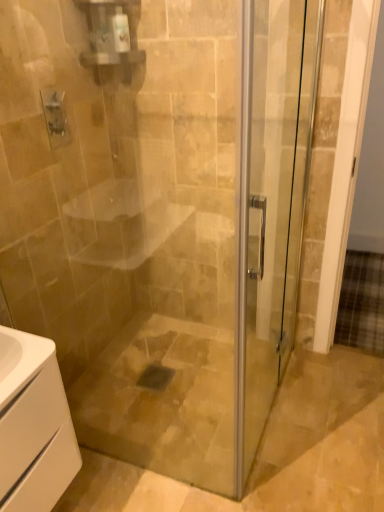
At what (x,y) coordinates should I click in order to perform the action: click on transparent glass shower door at right. Please return your answer as a coordinate pair (x, y). Looking at the image, I should click on (272, 200).

In order to face transparent glass shower door at right, should I rotate leftwards or rightwards?

Turn right by 11.849 degrees to look at transparent glass shower door at right.

The width and height of the screenshot is (384, 512). What do you see at coordinates (272, 200) in the screenshot?
I see `transparent glass shower door at right` at bounding box center [272, 200].

Measure the distance between transparent glass shower door at right and camera.

3.39 feet.

Measure the distance between point (63,490) and camera.

Point (63,490) and camera are 1.31 meters apart.

What is the approximate height of white matte cabinet at lower left?

white matte cabinet at lower left is 19.71 inches in height.

What do you see at coordinates (33, 425) in the screenshot?
I see `white matte cabinet at lower left` at bounding box center [33, 425].

This screenshot has width=384, height=512. In order to click on white matte cabinet at lower left in this screenshot , I will do `click(33, 425)`.

At what (x,y) coordinates should I click in order to perform the action: click on transparent glass shower door at right. Please return your answer as a coordinate pair (x, y). The width and height of the screenshot is (384, 512). Looking at the image, I should click on (272, 200).

Is white matte cabinet at lower left to the left of transparent glass shower door at right from the viewer's perspective?

Correct, you'll find white matte cabinet at lower left to the left of transparent glass shower door at right.

Consider the image. Between white matte cabinet at lower left and transparent glass shower door at right, which one is positioned in front?

transparent glass shower door at right is in front.

Does point (14, 395) come behind point (277, 164)?

No, (14, 395) is closer to viewer.

From the image's perspective, which is above, white matte cabinet at lower left or transparent glass shower door at right?

transparent glass shower door at right appears higher in the image.

From a real-world perspective, which is physically below, white matte cabinet at lower left or transparent glass shower door at right?

white matte cabinet at lower left.

Looking at their sizes, would you say white matte cabinet at lower left is wider or thinner than transparent glass shower door at right?

Considering their sizes, white matte cabinet at lower left looks broader than transparent glass shower door at right.

Considering the sizes of objects white matte cabinet at lower left and transparent glass shower door at right in the image provided, who is shorter, white matte cabinet at lower left or transparent glass shower door at right?

white matte cabinet at lower left is shorter.

Considering the sizes of objects white matte cabinet at lower left and transparent glass shower door at right in the image provided, who is smaller, white matte cabinet at lower left or transparent glass shower door at right?

white matte cabinet at lower left.

Is white matte cabinet at lower left completely or partially outside of transparent glass shower door at right?

Absolutely, white matte cabinet at lower left is external to transparent glass shower door at right.

Is white matte cabinet at lower left with transparent glass shower door at right?

They are not placed beside each other.

Could you tell me if white matte cabinet at lower left is facing transparent glass shower door at right?

No, white matte cabinet at lower left is not aimed at transparent glass shower door at right.

Consider the image. How many degrees apart are the facing directions of white matte cabinet at lower left and transparent glass shower door at right?

The angle between the facing direction of white matte cabinet at lower left and the facing direction of transparent glass shower door at right is 0.544 degrees.

You are a GUI agent. You are given a task and a screenshot of the screen. Output one action in this format:
    pyautogui.click(x=<x>, y=<y>)
    Task: Click on the bathroom cabinet behind the transparent glass shower door at right
    This screenshot has width=384, height=512.
    Given the screenshot: What is the action you would take?
    pyautogui.click(x=33, y=425)

Does transparent glass shower door at right appear on the right side of white matte cabinet at lower left?

Correct, you'll find transparent glass shower door at right to the right of white matte cabinet at lower left.

Is transparent glass shower door at right positioned in front of white matte cabinet at lower left?

Yes, transparent glass shower door at right is closer to the viewer.

Which is farther from the camera, (313, 55) or (61, 399)?

The point (313, 55) is farther from the camera.

From the image's perspective, is transparent glass shower door at right above or below white matte cabinet at lower left?

Clearly, from the image's perspective, transparent glass shower door at right is above white matte cabinet at lower left.

From a real-world perspective, between transparent glass shower door at right and white matte cabinet at lower left, who is vertically lower?

white matte cabinet at lower left, from a real-world perspective.

Considering the sizes of transparent glass shower door at right and white matte cabinet at lower left in the image, is transparent glass shower door at right wider or thinner than white matte cabinet at lower left?

Clearly, transparent glass shower door at right has less width compared to white matte cabinet at lower left.

Does transparent glass shower door at right have a greater height compared to white matte cabinet at lower left?

Correct, transparent glass shower door at right is much taller as white matte cabinet at lower left.

Does transparent glass shower door at right have a smaller size compared to white matte cabinet at lower left?

Actually, transparent glass shower door at right might be larger than white matte cabinet at lower left.

Is transparent glass shower door at right completely or partially outside of white matte cabinet at lower left?

Yes, transparent glass shower door at right is outside of white matte cabinet at lower left.

Would you consider transparent glass shower door at right to be distant from white matte cabinet at lower left?

No, transparent glass shower door at right is not far away from white matte cabinet at lower left.

Is transparent glass shower door at right aimed at white matte cabinet at lower left?

No, transparent glass shower door at right is not turned towards white matte cabinet at lower left.

Measure the distance between transparent glass shower door at right and white matte cabinet at lower left.

transparent glass shower door at right and white matte cabinet at lower left are 79.03 centimeters apart.

Locate an element on the screen. screen door that is on the right side of white matte cabinet at lower left is located at coordinates (272, 200).

Find the location of a particular element. screen door that is above the white matte cabinet at lower left (from the image's perspective) is located at coordinates (272, 200).

Locate an element on the screen. screen door in front of the white matte cabinet at lower left is located at coordinates (272, 200).